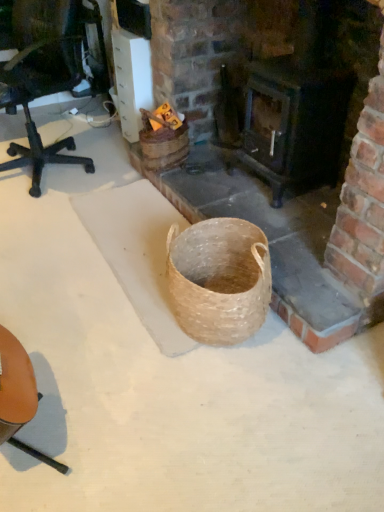
Question: From the image's perspective, is brick fireplace at center on top of brown leather chair at lower left?

Choices:
 (A) no
 (B) yes

Answer: (B)

Question: From a real-world perspective, is brick fireplace at center physically below brown leather chair at lower left?

Choices:
 (A) no
 (B) yes

Answer: (B)

Question: Does brick fireplace at center lie behind brown leather chair at lower left?

Choices:
 (A) yes
 (B) no

Answer: (A)

Question: Can you confirm if brick fireplace at center is taller than brown leather chair at lower left?

Choices:
 (A) yes
 (B) no

Answer: (B)

Question: Can you confirm if brick fireplace at center is shorter than brown leather chair at lower left?

Choices:
 (A) no
 (B) yes

Answer: (B)

Question: Do you think brick fireplace at center is within brown leather chair at lower left, or outside of it?

Choices:
 (A) outside
 (B) inside

Answer: (A)

Question: From the image's perspective, is brick fireplace at center located above or below brown leather chair at lower left?

Choices:
 (A) above
 (B) below

Answer: (A)

Question: From a real-world perspective, is brick fireplace at center physically located above or below brown leather chair at lower left?

Choices:
 (A) below
 (B) above

Answer: (A)

Question: Considering the positions of brick fireplace at center and brown leather chair at lower left in the image, is brick fireplace at center bigger or smaller than brown leather chair at lower left?

Choices:
 (A) big
 (B) small

Answer: (A)

Question: Considering the positions of point (352, 173) and point (342, 117), is point (352, 173) closer or farther from the camera than point (342, 117)?

Choices:
 (A) farther
 (B) closer

Answer: (B)

Question: Based on their sizes in the image, would you say brick fireplace at center is bigger or smaller than dark wood stove at center?

Choices:
 (A) big
 (B) small

Answer: (A)

Question: Choose the correct answer: Is brick fireplace at center inside dark wood stove at center or outside it?

Choices:
 (A) inside
 (B) outside

Answer: (B)

Question: Is brick fireplace at center wider or thinner than dark wood stove at center?

Choices:
 (A) thin
 (B) wide

Answer: (B)

Question: Considering their positions, is dark wood stove at center located in front of or behind brick fireplace at center?

Choices:
 (A) front
 (B) behind

Answer: (B)

Question: From a real-world perspective, is dark wood stove at center physically located above or below brick fireplace at center?

Choices:
 (A) below
 (B) above

Answer: (B)